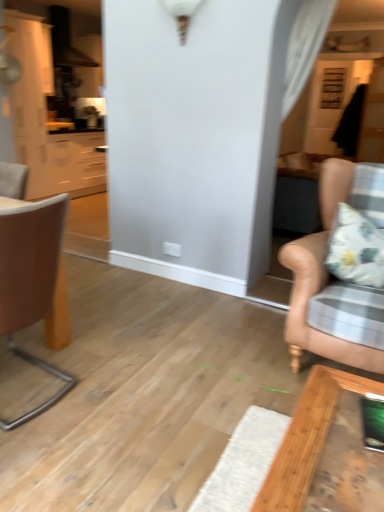
The width and height of the screenshot is (384, 512). What do you see at coordinates (322, 276) in the screenshot?
I see `leather couch at right, arranged as the second chair when viewed from the left` at bounding box center [322, 276].

What is the approximate height of matte white cabinets at left?

matte white cabinets at left is 7.00 feet tall.

The image size is (384, 512). Identify the location of leather couch at right, which is the first chair in right-to-left order. (322, 276).

Considering the positions of objects brown leather chair at left, which ranks as the first chair in left-to-right order, and leather couch at right, which is the first chair in right-to-left order, in the image provided, who is in front, brown leather chair at left, which ranks as the first chair in left-to-right order, or leather couch at right, which is the first chair in right-to-left order,?

brown leather chair at left, which ranks as the first chair in left-to-right order, is in front.

Is brown leather chair at left, which ranks as the first chair in left-to-right order, in contact with leather couch at right, which is the first chair in right-to-left order?

No, brown leather chair at left, which ranks as the first chair in left-to-right order, is not in contact with leather couch at right, which is the first chair in right-to-left order.

Between brown leather chair at left, positioned as the 2th chair in right-to-left order, and leather couch at right, arranged as the second chair when viewed from the left, which one has larger width?

leather couch at right, arranged as the second chair when viewed from the left.

From the image's perspective, which object appears higher, brown leather chair at left, which ranks as the first chair in left-to-right order, or leather couch at right, arranged as the second chair when viewed from the left?

leather couch at right, arranged as the second chair when viewed from the left, appears higher in the image.

Is there a large distance between leather couch at right, arranged as the second chair when viewed from the left, and matte white cabinets at left?

Yes.

Who is smaller, leather couch at right, arranged as the second chair when viewed from the left, or matte white cabinets at left?

leather couch at right, arranged as the second chair when viewed from the left, is smaller.

Can you confirm if leather couch at right, arranged as the second chair when viewed from the left, is shorter than matte white cabinets at left?

Yes, leather couch at right, arranged as the second chair when viewed from the left, is shorter than matte white cabinets at left.

Does leather couch at right, arranged as the second chair when viewed from the left, turn towards matte white cabinets at left?

No, leather couch at right, arranged as the second chair when viewed from the left, is not oriented towards matte white cabinets at left.

Which is nearer, (318, 277) or (63, 372)?

Point (318, 277) is closer to the camera than point (63, 372).

Find the location of a particular element. chair on the right of brown leather chair at left, which ranks as the first chair in left-to-right order is located at coordinates (322, 276).

Is leather couch at right, arranged as the second chair when viewed from the left, positioned with its back to brown leather chair at left, positioned as the 2th chair in right-to-left order?

No, leather couch at right, arranged as the second chair when viewed from the left, is not facing away from brown leather chair at left, positioned as the 2th chair in right-to-left order.

From a real-world perspective, between leather couch at right, which is the first chair in right-to-left order, and brown leather chair at left, which ranks as the first chair in left-to-right order, who is vertically lower?

In real-world perspective, brown leather chair at left, which ranks as the first chair in left-to-right order, is lower.

Based on the photo, from the image's perspective, is matte white cabinets at left above brown leather chair at left, positioned as the 2th chair in right-to-left order?

Yes, from the image's perspective, matte white cabinets at left is over brown leather chair at left, positioned as the 2th chair in right-to-left order.

Between matte white cabinets at left and brown leather chair at left, which ranks as the first chair in left-to-right order, which one has smaller width?

brown leather chair at left, which ranks as the first chair in left-to-right order.

Which is less distant, [18,16] or [15,229]?

Point [18,16] is farther from the camera than point [15,229].

From the image's perspective, is brown leather chair at left, which ranks as the first chair in left-to-right order, located above matte white cabinets at left?

No, from the image's perspective, brown leather chair at left, which ranks as the first chair in left-to-right order, is not above matte white cabinets at left.

Between brown leather chair at left, which ranks as the first chair in left-to-right order, and matte white cabinets at left, which one has less height?

Standing shorter between the two is brown leather chair at left, which ranks as the first chair in left-to-right order.

Considering the sizes of objects brown leather chair at left, positioned as the 2th chair in right-to-left order, and matte white cabinets at left in the image provided, who is smaller, brown leather chair at left, positioned as the 2th chair in right-to-left order, or matte white cabinets at left?

With smaller size is brown leather chair at left, positioned as the 2th chair in right-to-left order.

Is brown leather chair at left, positioned as the 2th chair in right-to-left order, outside of matte white cabinets at left?

Yes, brown leather chair at left, positioned as the 2th chair in right-to-left order, is not within matte white cabinets at left.

Does matte white cabinets at left have a greater width compared to leather couch at right, which is the first chair in right-to-left order?

No.

Is point (50, 140) behind point (372, 357)?

Yes.

Is matte white cabinets at left facing towards leather couch at right, which is the first chair in right-to-left order?

No, matte white cabinets at left is not turned towards leather couch at right, which is the first chair in right-to-left order.

You are a GUI agent. You are given a task and a screenshot of the screen. Output one action in this format:
    pyautogui.click(x=<x>, y=<y>)
    Task: Click on the chair that appears behind the brown leather chair at left, positioned as the 2th chair in right-to-left order
    
    Given the screenshot: What is the action you would take?
    (x=322, y=276)

Starting from the matte white cabinets at left, which chair is the 2nd one to the right? Please provide its 2D coordinates.

[(322, 276)]

From the image, which object appears to be farther from matte white cabinets at left, leather couch at right, arranged as the second chair when viewed from the left, or brown leather chair at left, which ranks as the first chair in left-to-right order?

leather couch at right, arranged as the second chair when viewed from the left, is positioned further to the anchor matte white cabinets at left.

Estimate the real-world distances between objects in this image. Which object is further from matte white cabinets at left, brown leather chair at left, positioned as the 2th chair in right-to-left order, or leather couch at right, arranged as the second chair when viewed from the left?

Based on the image, leather couch at right, arranged as the second chair when viewed from the left, appears to be further to matte white cabinets at left.

Considering their positions, is leather couch at right, which is the first chair in right-to-left order, positioned closer to brown leather chair at left, which ranks as the first chair in left-to-right order, than matte white cabinets at left?

leather couch at right, which is the first chair in right-to-left order, is positioned closer to the anchor brown leather chair at left, which ranks as the first chair in left-to-right order.

Which object lies further to the anchor point brown leather chair at left, which ranks as the first chair in left-to-right order, matte white cabinets at left or leather couch at right, which is the first chair in right-to-left order?

Among the two, matte white cabinets at left is located further to brown leather chair at left, which ranks as the first chair in left-to-right order.

Considering their positions, is matte white cabinets at left positioned further to leather couch at right, which is the first chair in right-to-left order, than brown leather chair at left, which ranks as the first chair in left-to-right order?

matte white cabinets at left is further to leather couch at right, which is the first chair in right-to-left order.

From the image, which object appears to be farther from leather couch at right, which is the first chair in right-to-left order, brown leather chair at left, which ranks as the first chair in left-to-right order, or matte white cabinets at left?

matte white cabinets at left.

I want to click on chair between brown leather chair at left, positioned as the 2th chair in right-to-left order, and matte white cabinets at left in the front-back direction, so click(322, 276).